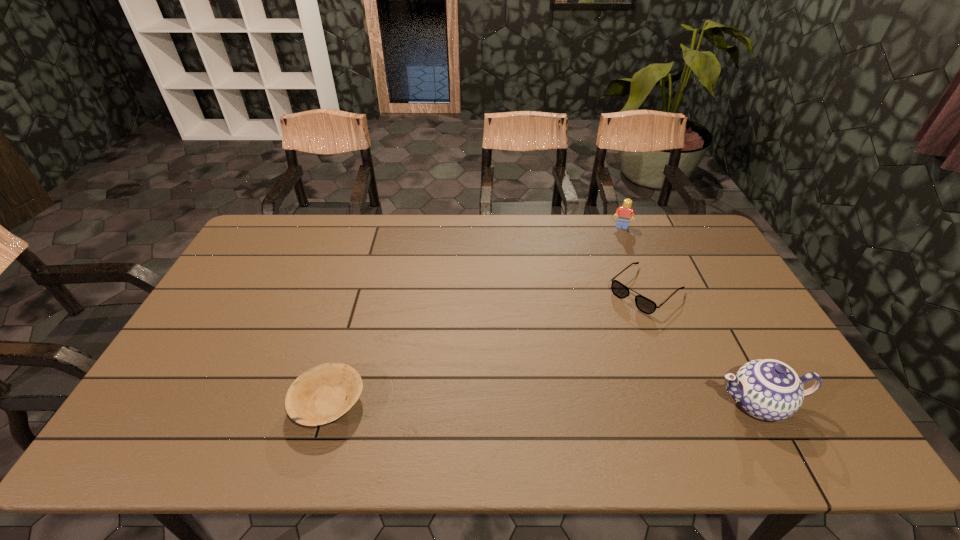
Where is `vacant space on the desktop that is between the leftmost object and the tallest object and is positioned on the front-facing side of the spectacles`? The width and height of the screenshot is (960, 540). vacant space on the desktop that is between the leftmost object and the tallest object and is positioned on the front-facing side of the spectacles is located at coordinates (516, 403).

The width and height of the screenshot is (960, 540). I want to click on vacant space on the desktop that is between the bowl and the tallest object and is positioned on the front-facing side of the farthest object, so click(593, 403).